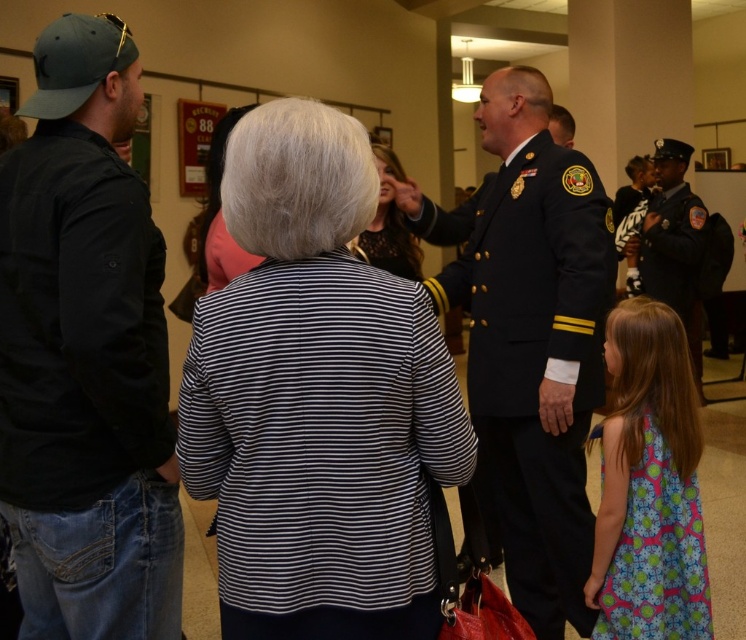
Who is more forward, (119, 630) or (380, 204)?

Point (119, 630) is in front.

Is black cotton jacket at left taller than black lace dress at center?

Indeed, black cotton jacket at left has a greater height compared to black lace dress at center.

Between point (34, 170) and point (407, 236), which one is positioned behind?

The point (407, 236) is behind.

Where is `black cotton jacket at left`? The height and width of the screenshot is (640, 746). black cotton jacket at left is located at coordinates (84, 355).

Does printed fabric dress at lower right lie behind black lace dress at center?

No, it is in front of black lace dress at center.

Based on the photo, who is positioned more to the right, printed fabric dress at lower right or black lace dress at center?

printed fabric dress at lower right is more to the right.

Does point (677, 365) lie in front of point (398, 225)?

Yes, it is in front of point (398, 225).

The image size is (746, 640). I want to click on printed fabric dress at lower right, so click(648, 484).

Locate an element on the screen. This screenshot has height=640, width=746. dark blue uniform at right is located at coordinates (671, 244).

Does dark blue uniform at right appear on the left side of black lace dress at center?

No, dark blue uniform at right is not to the left of black lace dress at center.

Where is `dark blue uniform at right`? The width and height of the screenshot is (746, 640). dark blue uniform at right is located at coordinates (671, 244).

Where is `dark blue uniform at right`? The width and height of the screenshot is (746, 640). dark blue uniform at right is located at coordinates coord(671,244).